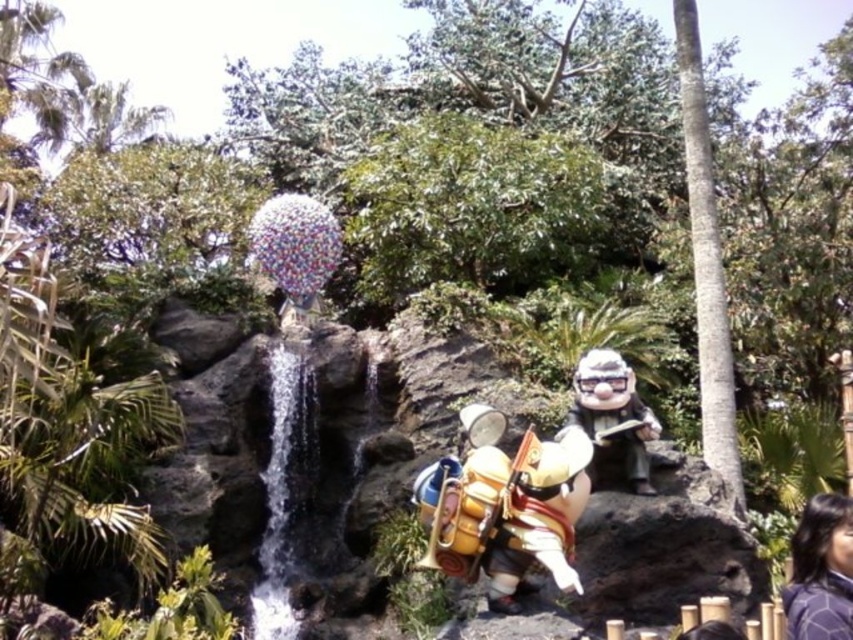
Question: In this image, where is matte brown statue at center located relative to gold metallic armor at center?

Choices:
 (A) below
 (B) above

Answer: (B)

Question: Is clear water at center positioned before gold metallic armor at center?

Choices:
 (A) yes
 (B) no

Answer: (B)

Question: Which object is the farthest from the matte brown statue at center?

Choices:
 (A) clear water at center
 (B) gold metallic armor at center

Answer: (A)

Question: Which of the following is the closest to the observer?

Choices:
 (A) (566, 516)
 (B) (805, 572)
 (C) (277, 536)

Answer: (B)

Question: Can you confirm if matte brown statue at center is wider than gold metallic armor at center?

Choices:
 (A) yes
 (B) no

Answer: (A)

Question: Which of the following is the farthest from the observer?

Choices:
 (A) (585, 416)
 (B) (299, 371)
 (C) (824, 636)

Answer: (B)